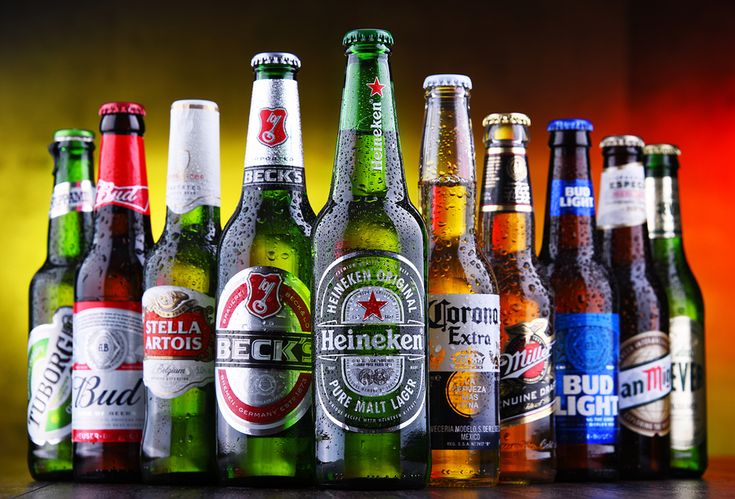
At what (x,y) coordinates should I click in order to perform the action: click on bottles of beer. Please return your answer as a coordinate pair (x, y). Looking at the image, I should click on click(x=664, y=250), click(x=631, y=243), click(x=566, y=243), click(x=512, y=218), click(x=456, y=204), click(x=351, y=180), click(x=276, y=208), click(x=196, y=216), click(x=123, y=237), click(x=68, y=239).